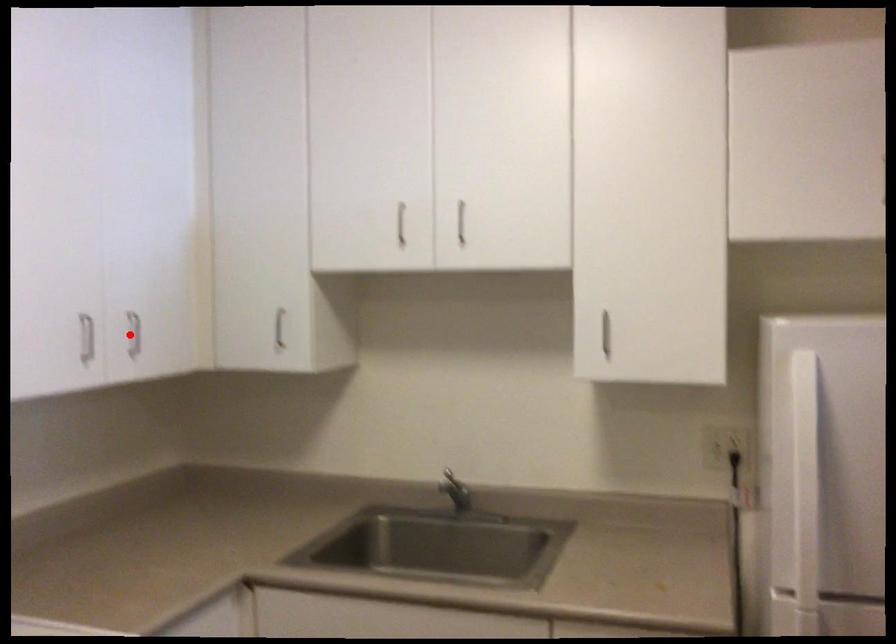
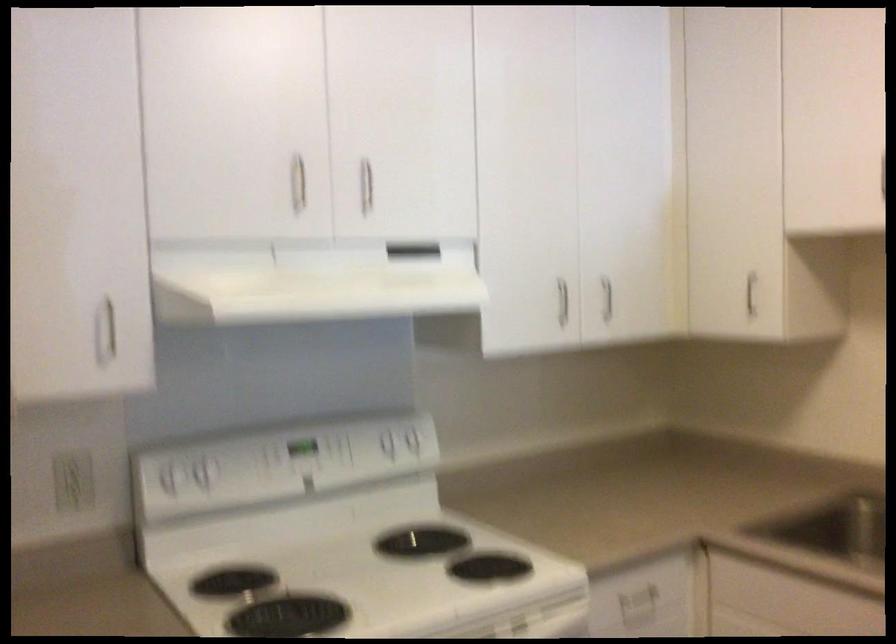
The point at the highlighted location is marked in the first image. Where is the corresponding point in the second image?

(607, 298)